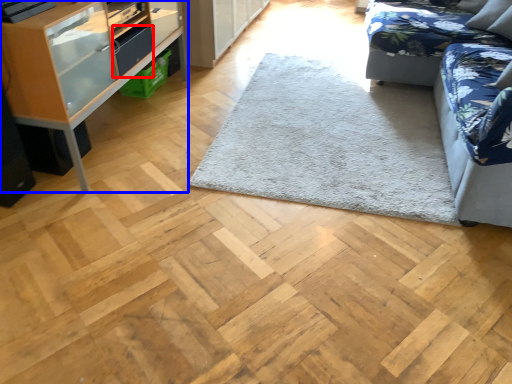
Question: Which of the following is the farthest to the observer, drawer (highlighted by a red box) or shelf (highlighted by a blue box)?

Choices:
 (A) drawer
 (B) shelf

Answer: (A)